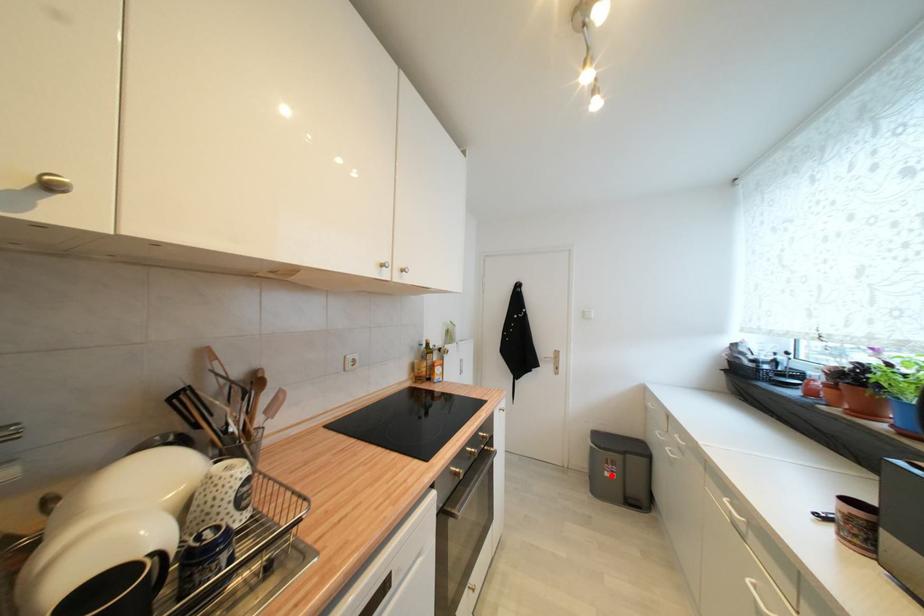
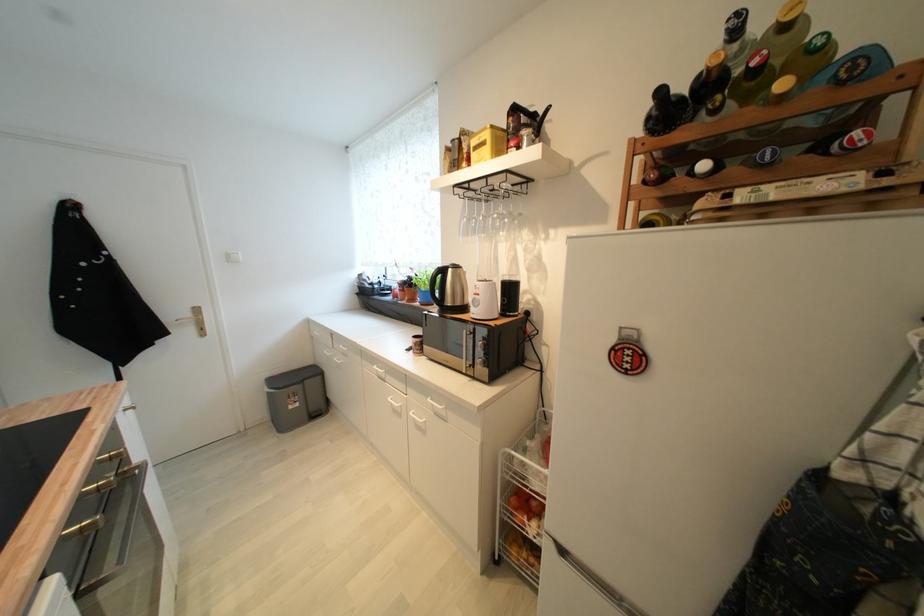
Find the pixel in the second image that matches the highlighted location in the first image.

(296, 408)